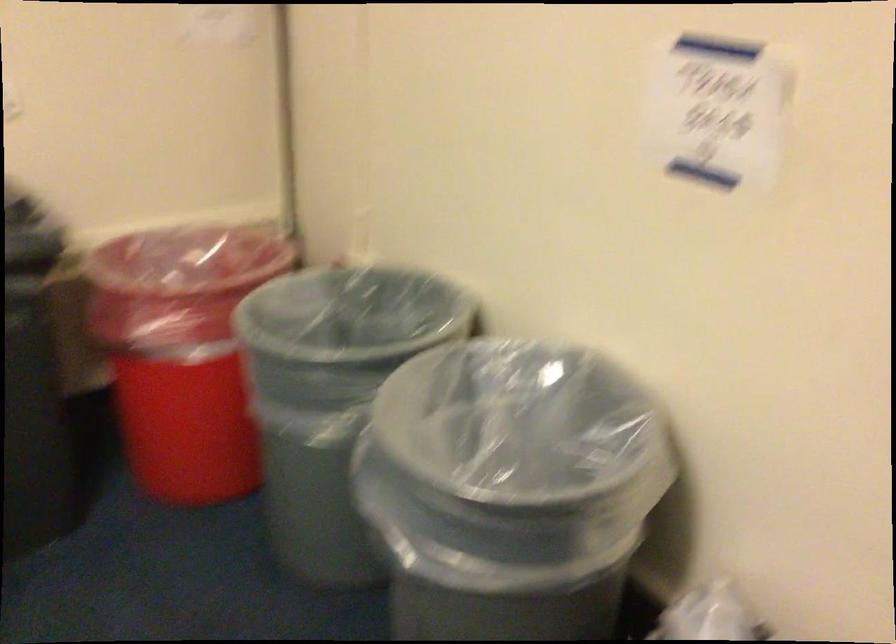
Where would you lift the grey trash can? Please return your answer as a coordinate pair (x, y).

(349, 315)